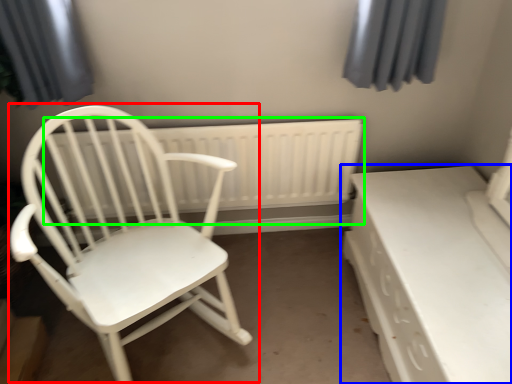
Question: Considering the real-world distances, which object is farthest from chair (highlighted by a red box)? table (highlighted by a blue box) or radiator (highlighted by a green box)?

Choices:
 (A) table
 (B) radiator

Answer: (A)